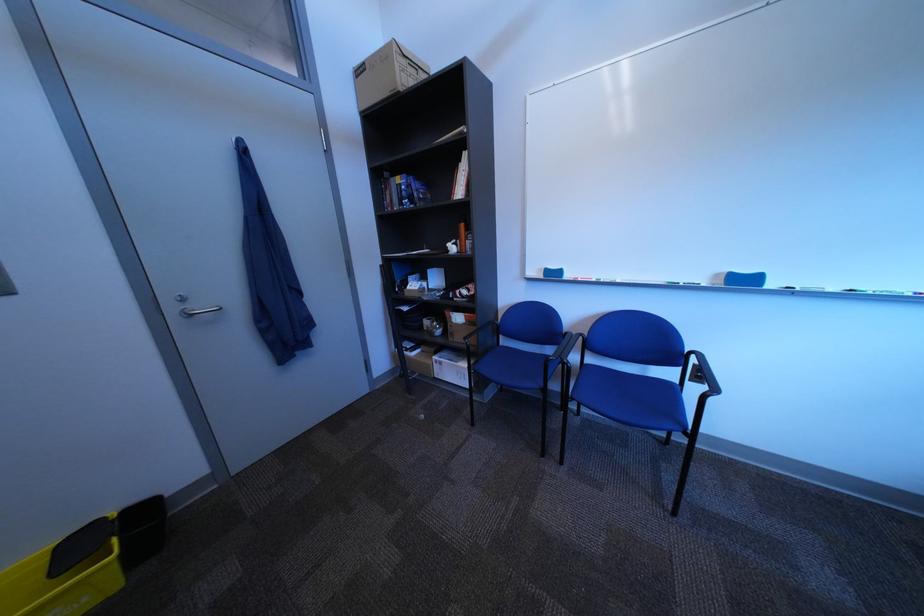
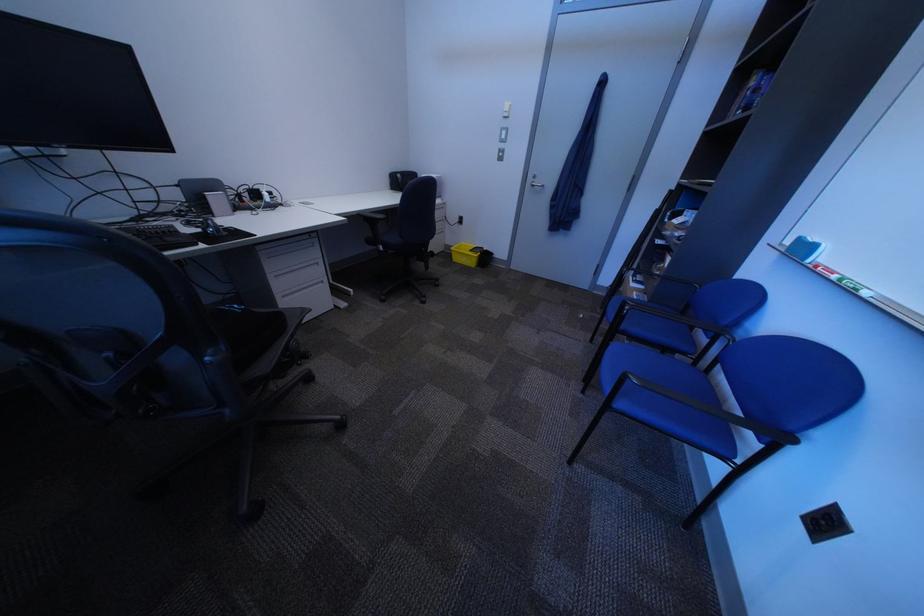
Find the pixel in the second image that matches point 440,418 in the first image.

(599, 318)